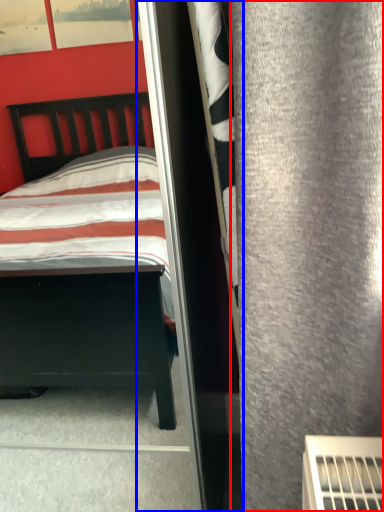
Question: Which of the following is the closest to the observer, curtain (highlighted by a red box) or screen door (highlighted by a blue box)?

Choices:
 (A) curtain
 (B) screen door

Answer: (A)